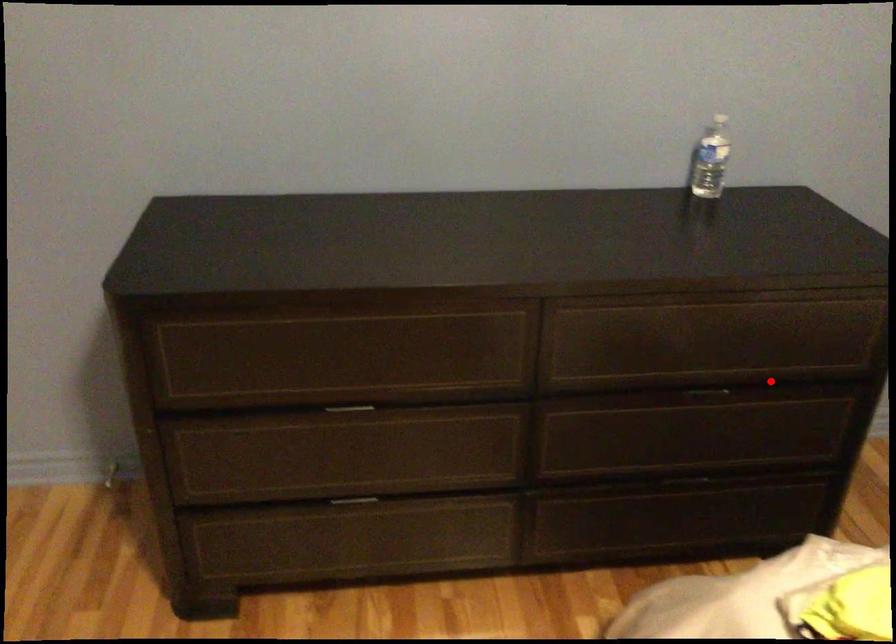
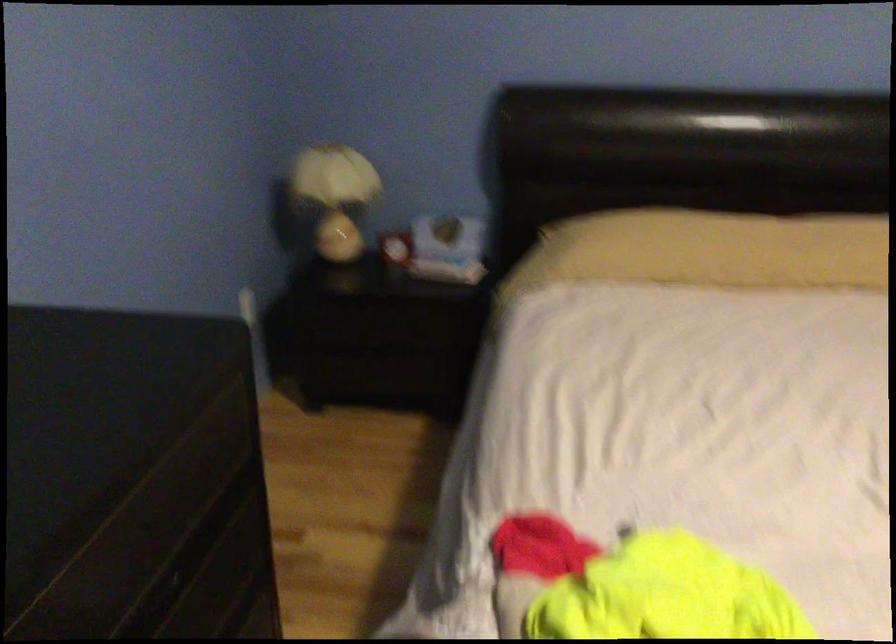
Question: I am providing you with two images of the same scene from different viewpoints. In image1, a red point is highlighted. Considering the same 3D point in image2, which of the following is correct?

Choices:
 (A) It is closer
 (B) It is farther

Answer: (A)